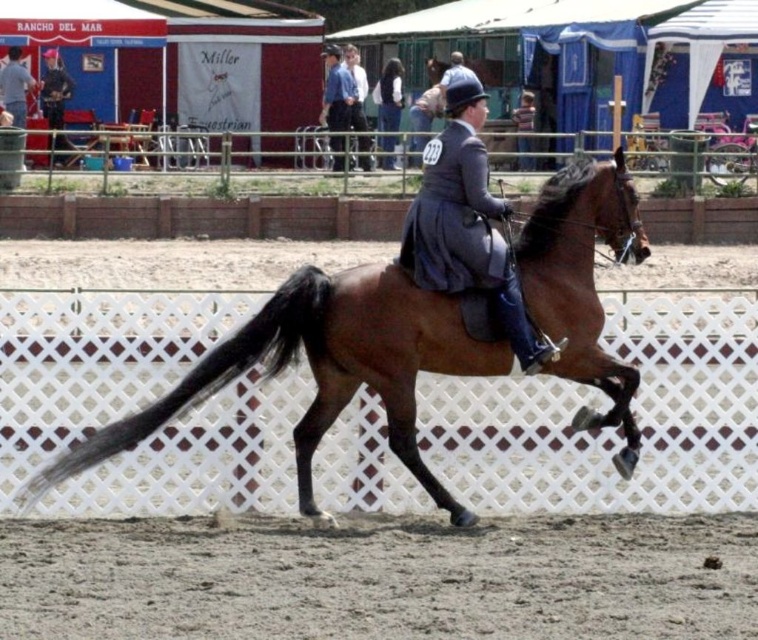
You are a photographer positioned at the center of the arena. You want to take a photo of the matte gray suit at center. Where should you aim your camera?

You should aim your camera at point (467, 227) to capture the matte gray suit at center.

You are a photographer positioned at the edge of the arena. You need to capture a photo where both the brown glossy horse at center and the matte gray suit at center are visible. Based on their positions, which object should you adjust your camera angle to focus on first to ensure both are in frame?

The brown glossy horse at center is to the left of matte gray suit at center. To ensure both are in frame, adjust your camera angle to focus on the brown glossy horse at center first, as it is positioned to the left, allowing the matte gray suit at center to come into view on the right side.